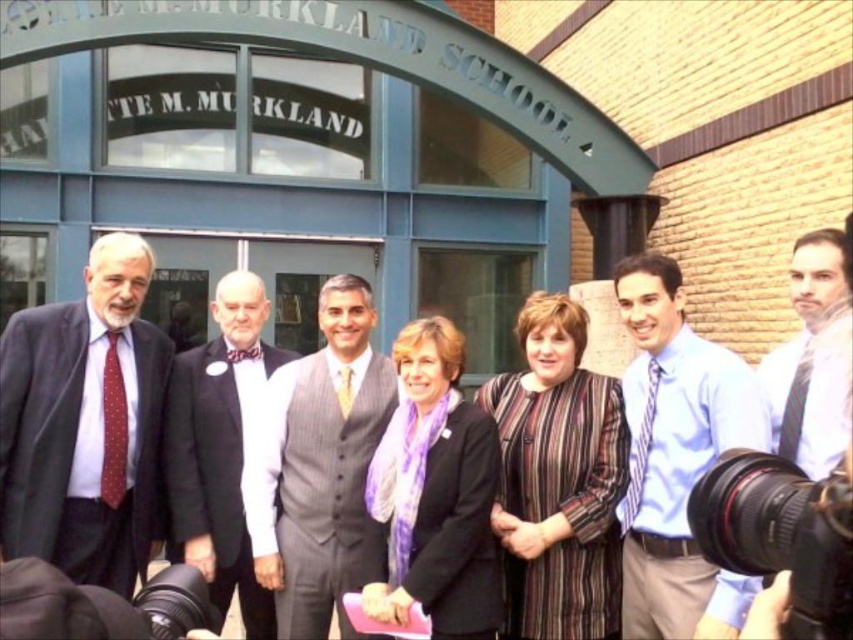
Question: Which of the following is the farthest from the observer?

Choices:
 (A) light blue silk tie at center
 (B) gray textured suit at center

Answer: (B)

Question: Does dark gray suit at left have a smaller size compared to white shirt at center?

Choices:
 (A) no
 (B) yes

Answer: (A)

Question: Which object appears farthest from the camera in this image?

Choices:
 (A) striped fabric coat at center
 (B) dark gray suit at left
 (C) polka dot silk tie at left
 (D) purple silk scarf at center

Answer: (C)

Question: Is white shirt at center to the right of light brown textured tie at center from the viewer's perspective?

Choices:
 (A) no
 (B) yes

Answer: (B)

Question: Estimate the real-world distances between objects in this image. Which object is closer to the black satin bow tie at center?

Choices:
 (A) gray textured suit at center
 (B) purple silk scarf at center
 (C) light blue silk tie at center

Answer: (A)

Question: Can you confirm if dark gray suit at left is positioned below black plastic video camera at lower left?

Choices:
 (A) no
 (B) yes

Answer: (A)